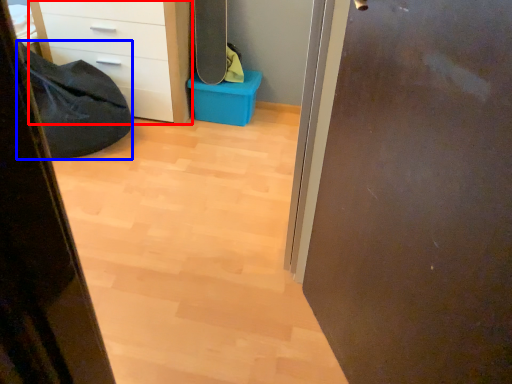
Question: Which of the following is the farthest to the observer, chest of drawers (highlighted by a red box) or sleeping bag (highlighted by a blue box)?

Choices:
 (A) chest of drawers
 (B) sleeping bag

Answer: (A)